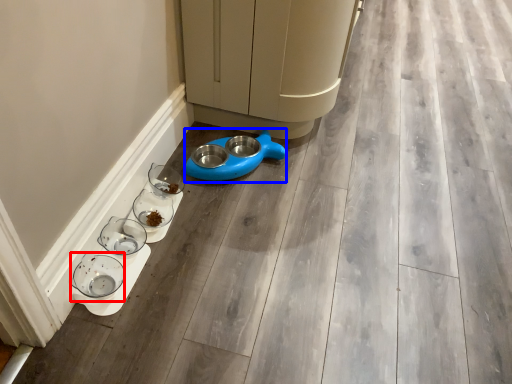
Question: Among these objects, which one is nearest to the camera, glass bowl (highlighted by a red box) or appliance (highlighted by a blue box)?

Choices:
 (A) glass bowl
 (B) appliance

Answer: (A)